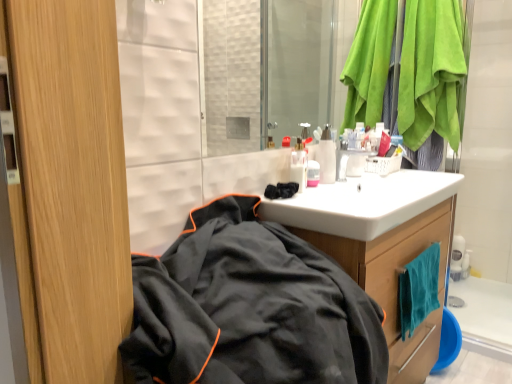
Question: Can you confirm if white glossy sink at center is bigger than pink glossy container at center, the second toiletry viewed from the left?

Choices:
 (A) yes
 (B) no

Answer: (A)

Question: Is white glossy sink at center positioned beyond the bounds of pink glossy container at center, the second toiletry viewed from the left?

Choices:
 (A) yes
 (B) no

Answer: (A)

Question: From a real-world perspective, is white glossy sink at center located higher than pink glossy container at center, the second toiletry viewed from the left?

Choices:
 (A) yes
 (B) no

Answer: (B)

Question: Can you confirm if white glossy sink at center is wider than pink glossy container at center, marked as the first toiletry in a right-to-left arrangement?

Choices:
 (A) no
 (B) yes

Answer: (B)

Question: Is white glossy sink at center next to pink glossy container at center, marked as the first toiletry in a right-to-left arrangement, and touching it?

Choices:
 (A) no
 (B) yes

Answer: (A)

Question: In terms of size, does green suede towel at upper right appear bigger or smaller than teal microfiber towel at lower right?

Choices:
 (A) small
 (B) big

Answer: (B)

Question: Does point (454, 39) appear closer or farther from the camera than point (417, 258)?

Choices:
 (A) closer
 (B) farther

Answer: (B)

Question: From a real-world perspective, is green suede towel at upper right above or below teal microfiber towel at lower right?

Choices:
 (A) above
 (B) below

Answer: (A)

Question: In the image, is green suede towel at upper right positioned in front of or behind teal microfiber towel at lower right?

Choices:
 (A) front
 (B) behind

Answer: (B)

Question: Based on their sizes in the image, would you say wooden cabinet at center is bigger or smaller than green suede towel at upper right?

Choices:
 (A) big
 (B) small

Answer: (A)

Question: Visually, is wooden cabinet at center positioned to the left or to the right of green suede towel at upper right?

Choices:
 (A) right
 (B) left

Answer: (B)

Question: Choose the correct answer: Is wooden cabinet at center inside green suede towel at upper right or outside it?

Choices:
 (A) outside
 (B) inside

Answer: (A)

Question: In terms of width, does wooden cabinet at center look wider or thinner when compared to green suede towel at upper right?

Choices:
 (A) wide
 (B) thin

Answer: (A)

Question: Is translucent plastic bottles at center, which ranks as the first toiletry in left-to-right order, in front of or behind green suede towel at upper right in the image?

Choices:
 (A) front
 (B) behind

Answer: (A)

Question: From the image's perspective, is translucent plastic bottles at center, which is the second toiletry in right-to-left order, above or below green suede towel at upper right?

Choices:
 (A) above
 (B) below

Answer: (B)